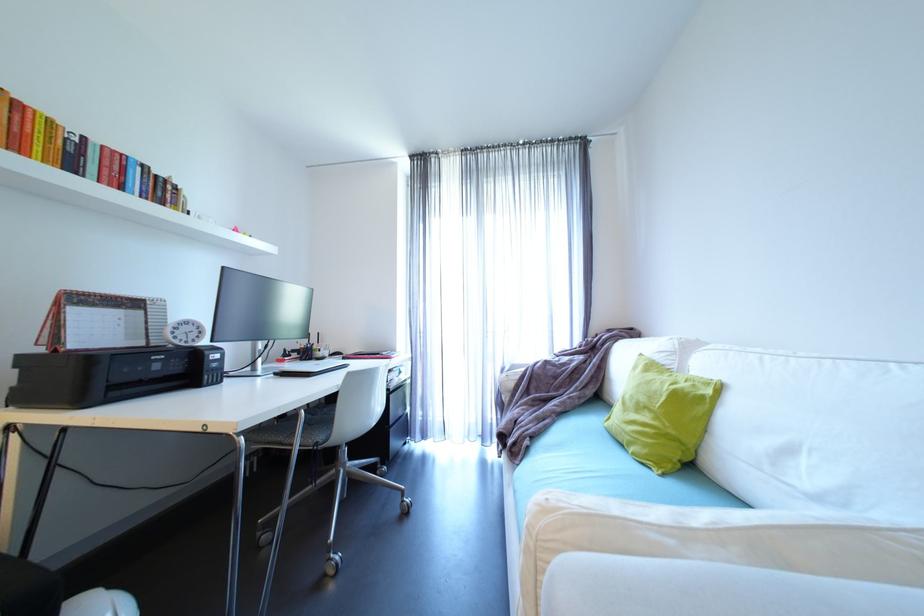
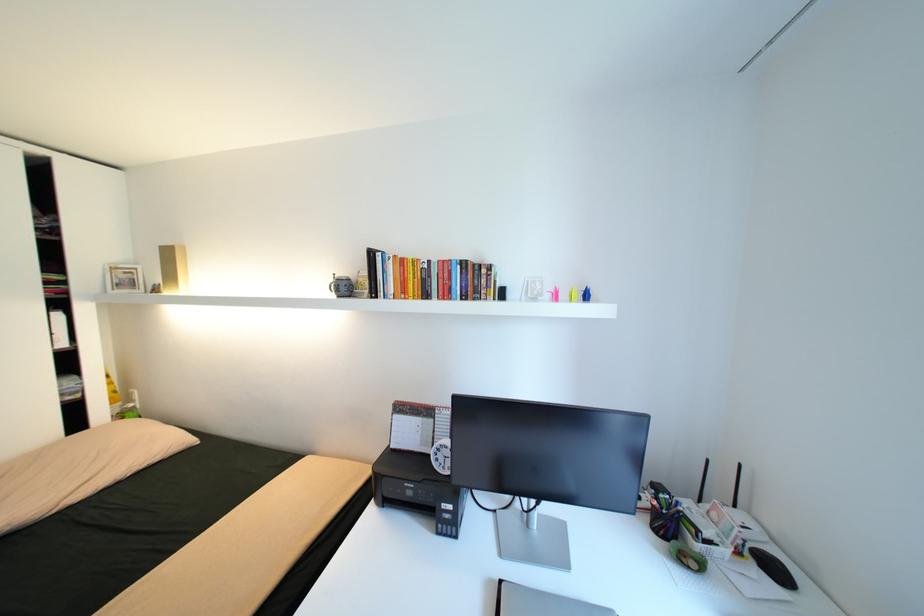
Find the pixel in the second image that matches (x=111, y=147) in the first image.

(445, 262)